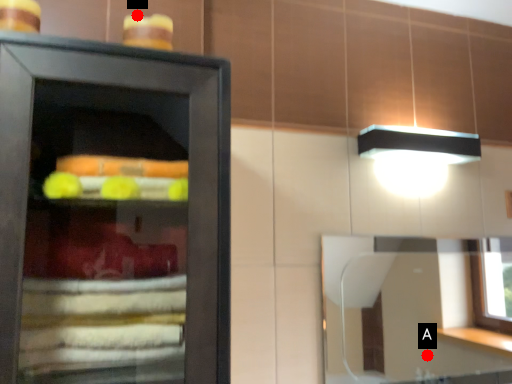
Question: Two points are circled on the image, labeled by A and B beside each circle. Which of the following is the farthest from the observer?

Choices:
 (A) A is further
 (B) B is further

Answer: (A)